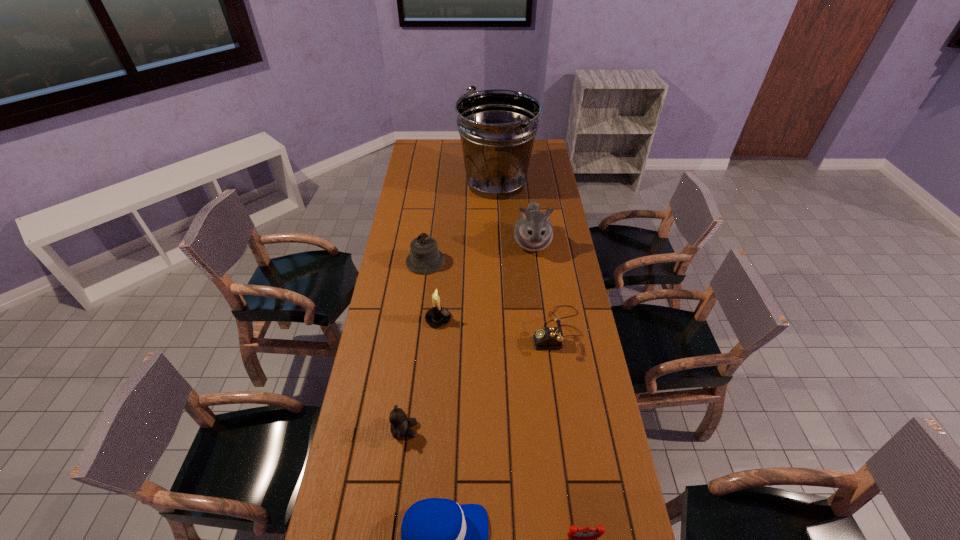
Locate an element on the screen. the tallest object is located at coordinates (497, 127).

Locate an element on the screen. This screenshot has height=540, width=960. the farthest object is located at coordinates (497, 127).

Identify the location of hamster. (533, 231).

The image size is (960, 540). Find the location of `bell`. bell is located at coordinates (425, 258).

Locate an element on the screen. candle holder is located at coordinates (437, 316).

Identify the location of teddy bear. This screenshot has height=540, width=960. (400, 425).

At what (x,y) coordinates should I click in order to perform the action: click on telephone. Please return your answer as a coordinate pair (x, y). Looking at the image, I should click on (551, 337).

The image size is (960, 540). Identify the location of vacant region located 0.060m on the front of the farthest object. (497, 213).

The image size is (960, 540). Identify the location of free location located 0.190m on the face of the seventh shortest object. (539, 295).

Find the location of a particular element. free spot located on the back of the bell is located at coordinates pos(431,220).